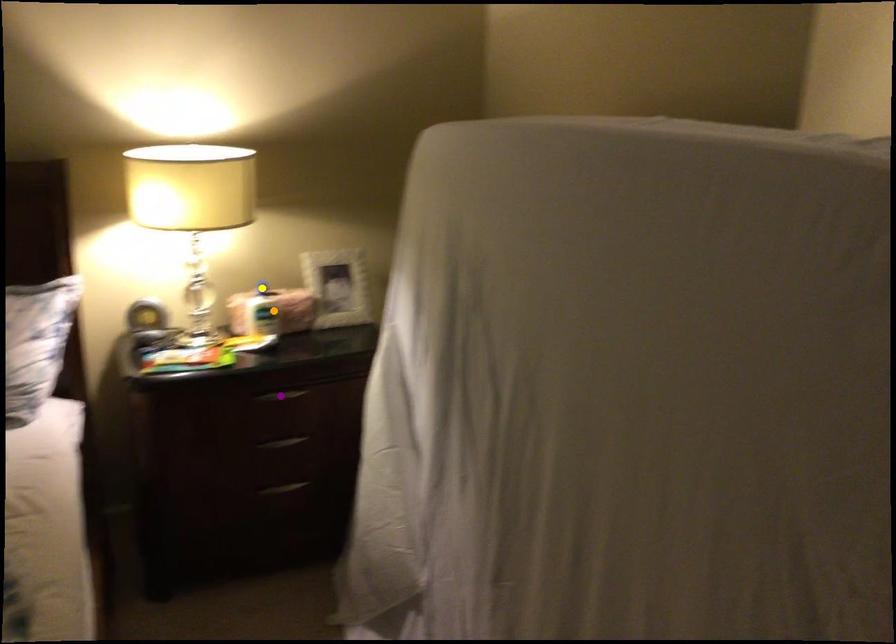
Order these from farthest to nearest:
- purple point
- yellow point
- orange point

orange point, yellow point, purple point